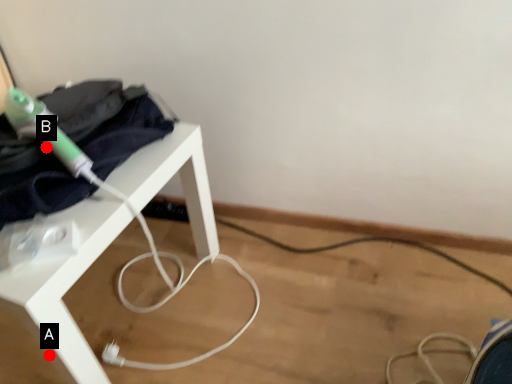
Question: Two points are circled on the image, labeled by A and B beside each circle. Which point is farther from the camera taking this photo?

Choices:
 (A) A is further
 (B) B is further

Answer: (A)